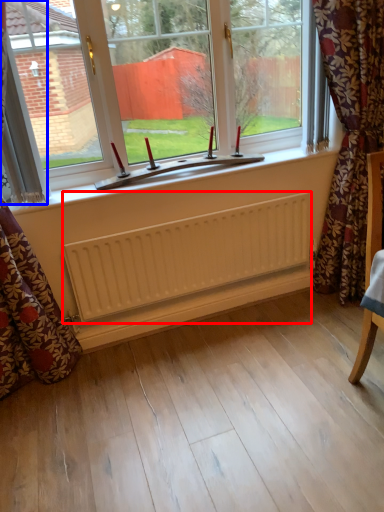
Question: Which point is closer to the camera, radiator (highlighted by a red box) or curtain (highlighted by a blue box)?

Choices:
 (A) radiator
 (B) curtain

Answer: (B)